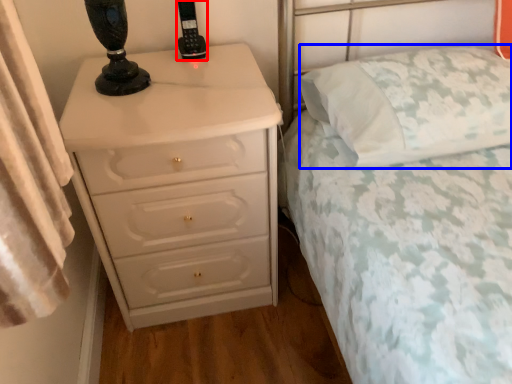
Question: Which of the following is the farthest to the observer, control (highlighted by a red box) or pillow (highlighted by a blue box)?

Choices:
 (A) control
 (B) pillow

Answer: (A)